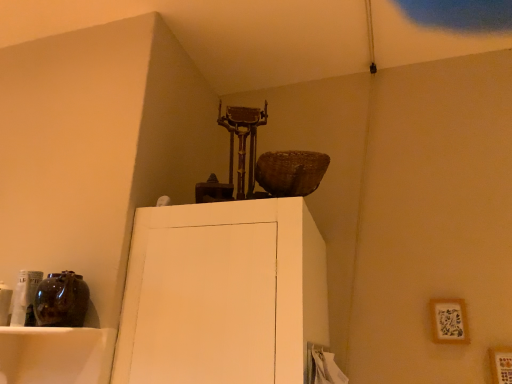
Question: Is wooden picture frame at lower right, positioned as the first picture frame in right-to-left order, wider or thinner than wooden picture frame at upper right, the 1th picture frame positioned from the back?

Choices:
 (A) wide
 (B) thin

Answer: (A)

Question: In terms of height, does wooden picture frame at lower right, marked as the second picture frame in a left-to-right arrangement, look taller or shorter compared to wooden picture frame at upper right, which is counted as the second picture frame, starting from the front?

Choices:
 (A) short
 (B) tall

Answer: (A)

Question: Is point (495, 365) closer or farther from the camera than point (443, 299)?

Choices:
 (A) farther
 (B) closer

Answer: (B)

Question: From their relative heights in the image, would you say wooden picture frame at upper right, which is counted as the second picture frame, starting from the front, is taller or shorter than wooden picture frame at lower right, which is counted as the first picture frame, starting from the front?

Choices:
 (A) short
 (B) tall

Answer: (A)

Question: Visually, is wooden picture frame at upper right, positioned as the first picture frame in left-to-right order, positioned to the left or to the right of wooden picture frame at lower right, which ranks as the second picture frame in back-to-front order?

Choices:
 (A) right
 (B) left

Answer: (B)

Question: From the image's perspective, is wooden picture frame at upper right, which appears as the 2th picture frame when viewed from the right, located above or below wooden picture frame at lower right, positioned as the first picture frame in right-to-left order?

Choices:
 (A) above
 (B) below

Answer: (A)

Question: Based on their sizes in the image, would you say wooden picture frame at upper right, positioned as the first picture frame in left-to-right order, is bigger or smaller than wooden picture frame at lower right, which appears as the second picture frame when viewed from the top?

Choices:
 (A) small
 (B) big

Answer: (A)